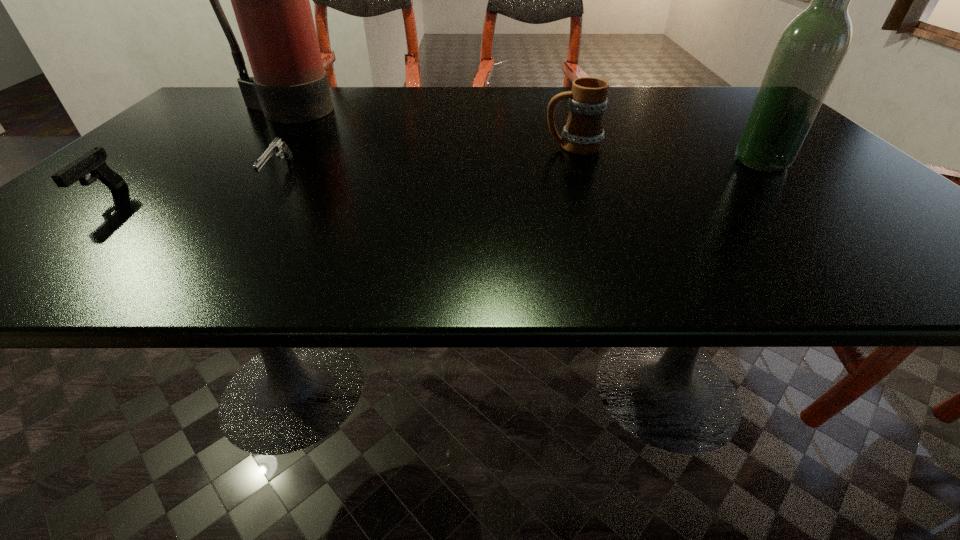
Locate an element on the screen. vacant point located 0.280m on the side of the third shortest object with the handle is located at coordinates (416, 147).

Where is `free space located 0.350m on the side of the third shortest object with the handle`? free space located 0.350m on the side of the third shortest object with the handle is located at coordinates (384, 147).

This screenshot has height=540, width=960. Identify the location of free space located 0.140m on the side of the third shortest object with the handle. (480, 147).

Find the location of a particular element. The width and height of the screenshot is (960, 540). blank area located on the front-facing side of the leftmost object is located at coordinates (60, 234).

What are the coordinates of `vacant space situated 0.190m on the front-facing side of the right pistol` in the screenshot? It's located at (219, 260).

Identify the location of object that is at the far edge. This screenshot has height=540, width=960. pos(270,0).

Identify the location of fire extinguisher situated at the left edge. (270, 0).

At what (x,y) coordinates should I click in order to perform the action: click on pistol that is at the left edge. Please return your answer as a coordinate pair (x, y). Looking at the image, I should click on (93, 162).

Image resolution: width=960 pixels, height=540 pixels. Identify the location of object positioned at the right edge. (809, 52).

Identify the location of object that is at the far left corner. The width and height of the screenshot is (960, 540). point(270,0).